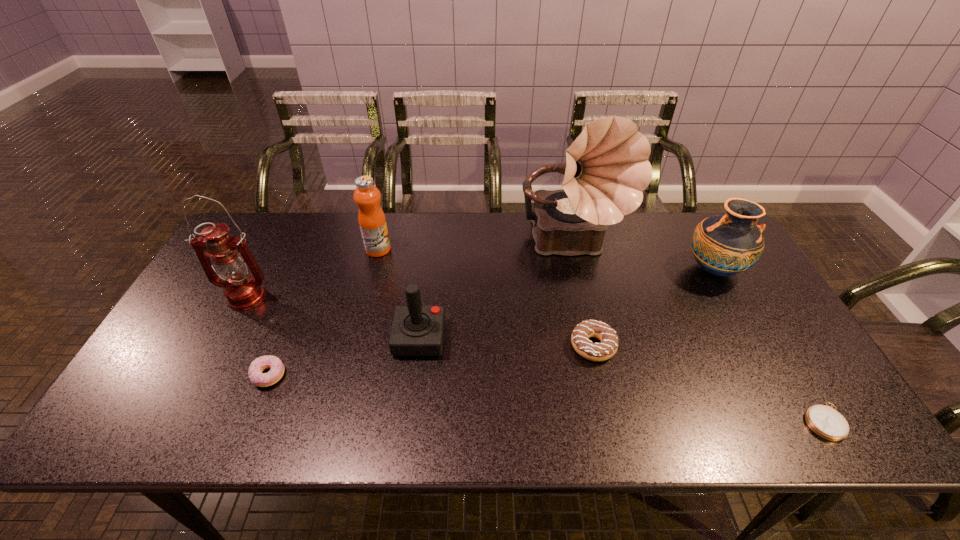
Where is `empty location between the record player and the third object from left to right`? This screenshot has height=540, width=960. empty location between the record player and the third object from left to right is located at coordinates (475, 248).

Where is `free area in between the fifth tallest object and the nearest object`? This screenshot has width=960, height=540. free area in between the fifth tallest object and the nearest object is located at coordinates (622, 380).

Where is `vacant point located between the pottery and the leftmost object`? vacant point located between the pottery and the leftmost object is located at coordinates (480, 284).

The height and width of the screenshot is (540, 960). Find the location of `free point between the fifth object from right to left and the compass`. free point between the fifth object from right to left and the compass is located at coordinates [x=622, y=380].

Locate an element on the screen. The image size is (960, 540). free point between the right doughnut and the pottery is located at coordinates (654, 308).

You are a GUI agent. You are given a task and a screenshot of the screen. Output one action in this format:
    pyautogui.click(x=<x>, y=<y>)
    Task: Click on the object that ranks as the fifth closest to the leftmost object
    The height and width of the screenshot is (540, 960).
    Given the screenshot: What is the action you would take?
    pyautogui.click(x=601, y=351)

Choose which object is the sixth nearest neighbor to the joystick. Please provide its 2D coordinates. Your answer should be formatted as a tuple, i.e. [(x, y)], where the tuple contains the x and y coordinates of a point satisfying the conditions above.

[(724, 245)]

Where is `free location that satisfies the following two spatial constraints: 1. on the base of the right doughnut; 2. on the left side of the joystick`? This screenshot has height=540, width=960. free location that satisfies the following two spatial constraints: 1. on the base of the right doughnut; 2. on the left side of the joystick is located at coordinates (419, 346).

The height and width of the screenshot is (540, 960). I want to click on vacant area in the image that satisfies the following two spatial constraints: 1. on the back side of the third object from left to right; 2. on the left side of the leftmost object, so click(x=271, y=249).

Locate an element on the screen. vacant space that satisfies the following two spatial constraints: 1. from the horn of the tallest object; 2. on the base of the fourth object from left to right is located at coordinates (595, 338).